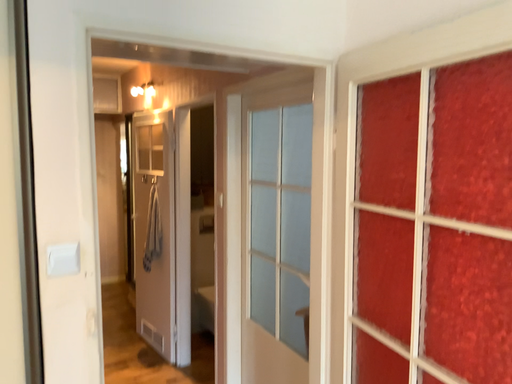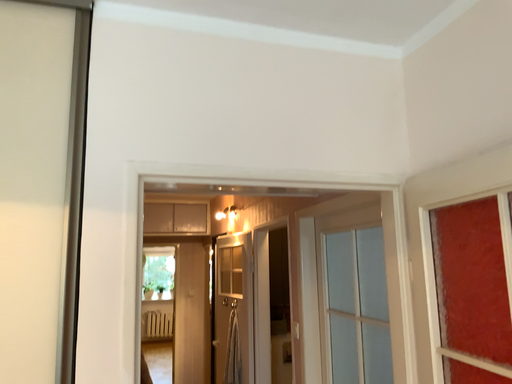
Question: How did the camera likely rotate when shooting the video?

Choices:
 (A) rotated left
 (B) rotated right

Answer: (A)